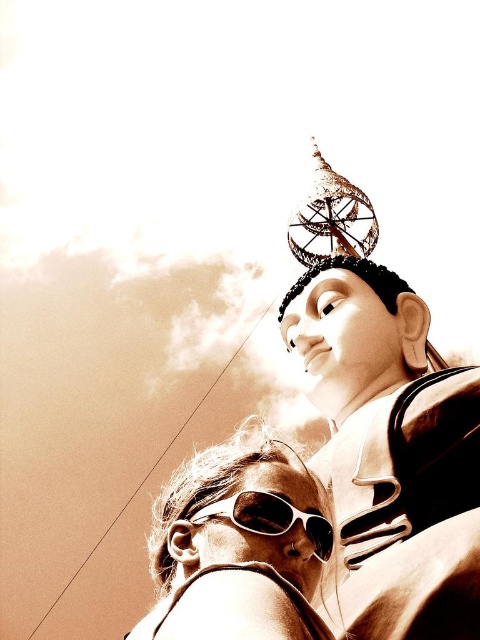
You are a photographer adjusting your equipment in the scene. You have two items to place on a shelf in the background. The shelf has limited space. The sunglasses at lower center and the white matte goggles at center must be placed such that the goggles are above the sunglasses. Can you position them correctly?

Yes, since the sunglasses at lower center is located below the white matte goggles at center, placing the goggles above the sunglasses aligns with their current positions in the scene.